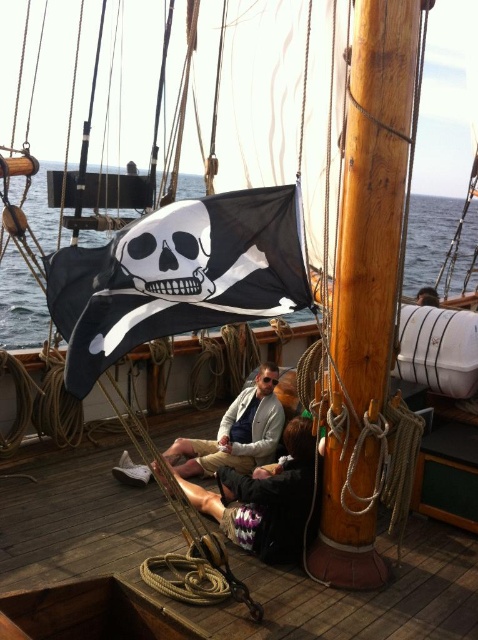
You are standing on the wooden deck at center and need to reach the khaki cotton pants at center to retrieve a hidden treasure map. Can you comfortably reach them without moving your feet? Explain your reasoning based on the distance provided.

The wooden deck at center is 39.25 inches away from the khaki cotton pants at center. Since the distance is over 3 feet, it would be difficult to reach the pants without moving your feet, so you would need to step closer to retrieve the map.

You are standing on the deck of the wooden sailing ship and see the dark brown leather hammock at center and the khaki cotton pants at center. Which object is nearer to you?

The dark brown leather hammock at center is closer to the viewer than the khaki cotton pants at center.